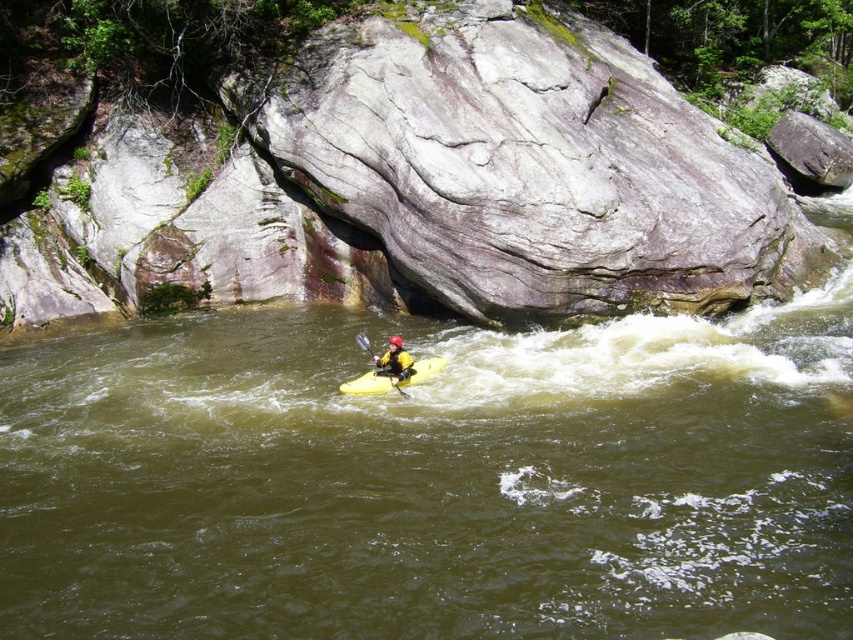
Question: Which point is closer to the camera taking this photo?

Choices:
 (A) (401, 394)
 (B) (607, 432)

Answer: (B)

Question: From the image, what is the correct spatial relationship of yellow matte kayak at center in relation to yellow plastic paddle at center?

Choices:
 (A) below
 (B) above

Answer: (A)

Question: Does gray rough rock at center appear over yellow matte kayak at center?

Choices:
 (A) yes
 (B) no

Answer: (A)

Question: Among these objects, which one is nearest to the camera?

Choices:
 (A) gray rough rock at center
 (B) yellow matte kayak at center
 (C) yellow plastic paddle at center
 (D) greenish-brown water at center

Answer: (D)

Question: Estimate the real-world distances between objects in this image. Which object is farther from the greenish-brown water at center?

Choices:
 (A) gray rough rock at center
 (B) yellow rubber kayak at center

Answer: (A)

Question: Does gray rough rock at center lie in front of yellow plastic paddle at center?

Choices:
 (A) no
 (B) yes

Answer: (A)